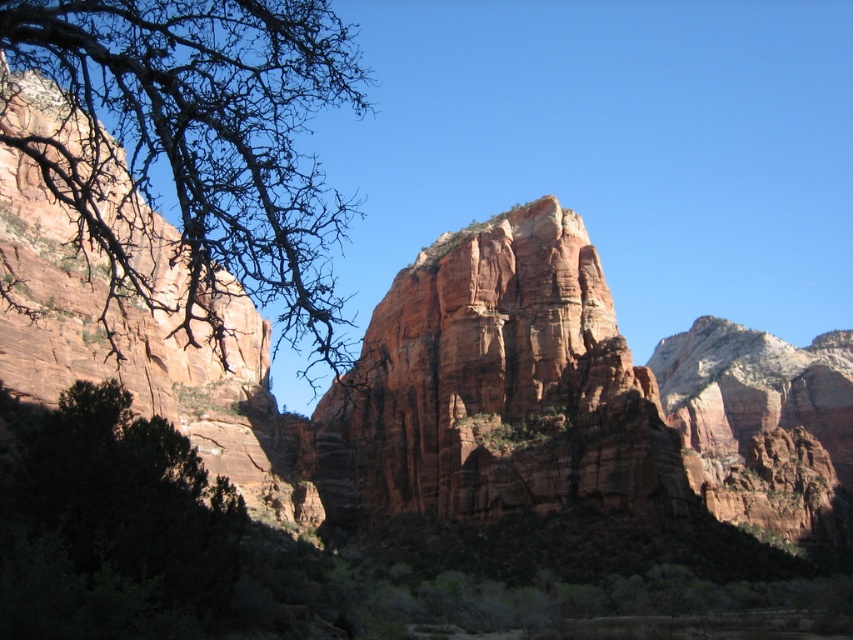
Question: Which point is closer to the camera?

Choices:
 (A) dark green leafy tree at lower left
 (B) reddish-brown sandstone cliff at center

Answer: (A)

Question: Does bare branches at left appear on the right side of dark green leafy tree at lower left?

Choices:
 (A) no
 (B) yes

Answer: (A)

Question: Estimate the real-world distances between objects in this image. Which object is farther from the dark green leafy tree at lower left?

Choices:
 (A) reddish-brown sandstone cliff at center
 (B) bare branches at left

Answer: (A)

Question: Can you confirm if bare branches at left is smaller than reddish-brown sandstone cliff at center?

Choices:
 (A) no
 (B) yes

Answer: (A)

Question: Which of these objects is positioned farthest from the reddish-brown sandstone cliff at center?

Choices:
 (A) bare branches at left
 (B) dark green leafy tree at lower left

Answer: (B)

Question: Does bare branches at left have a larger size compared to dark green leafy tree at lower left?

Choices:
 (A) no
 (B) yes

Answer: (B)